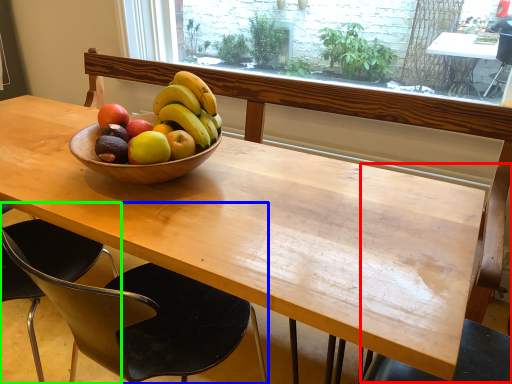
Question: Which is farther away from chair (highlighted by a red box)? chair (highlighted by a blue box) or chair (highlighted by a green box)?

Choices:
 (A) chair
 (B) chair

Answer: (B)